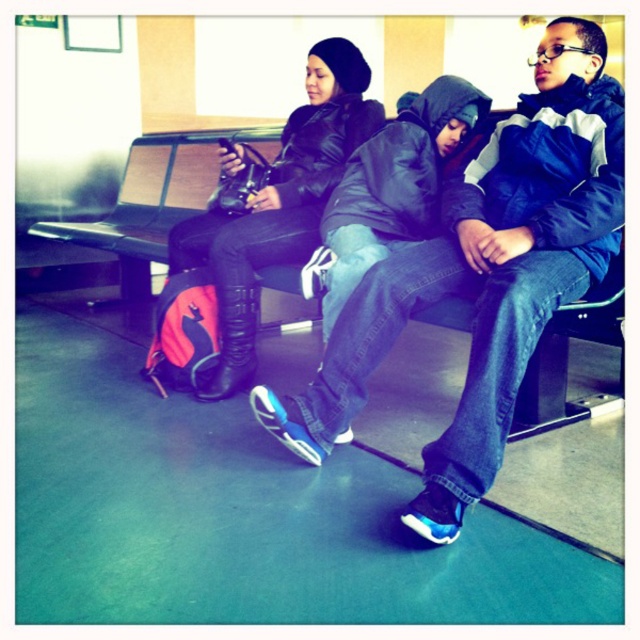
Question: Can you confirm if black leather jacket at center is bigger than metallic gray bench at center?

Choices:
 (A) no
 (B) yes

Answer: (A)

Question: Is blue suede sneakers at center above black leather jacket at center?

Choices:
 (A) yes
 (B) no

Answer: (B)

Question: Estimate the real-world distances between objects in this image. Which object is farther from the metallic gray bench at center?

Choices:
 (A) blue suede sneakers at center
 (B) black leather jacket at center

Answer: (A)

Question: Estimate the real-world distances between objects in this image. Which object is farther from the black leather jacket at center?

Choices:
 (A) metallic gray bench at center
 (B) blue suede sneakers at center

Answer: (B)

Question: Based on their relative distances, which object is nearer to the black leather jacket at center?

Choices:
 (A) blue suede sneakers at center
 (B) metallic gray bench at center

Answer: (B)

Question: Is blue suede sneakers at center positioned in front of black leather jacket at center?

Choices:
 (A) yes
 (B) no

Answer: (A)